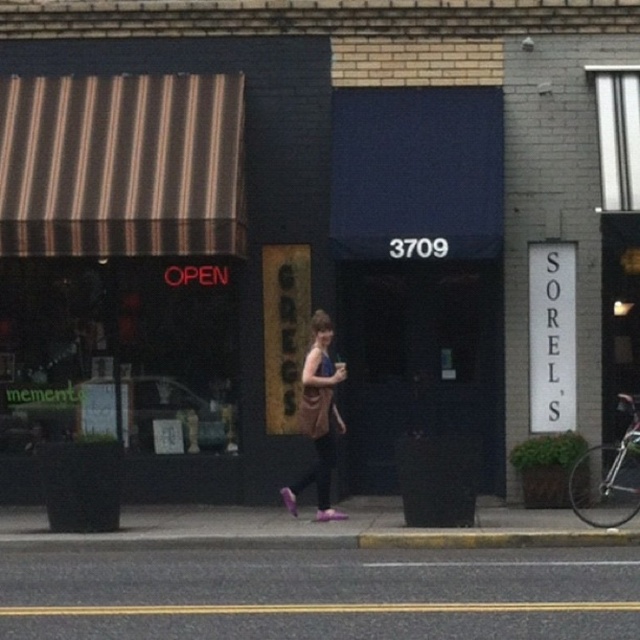
Question: Can you confirm if black asphalt road at lower center is positioned to the left of matte brown purse at center?

Choices:
 (A) no
 (B) yes

Answer: (B)

Question: Which object is positioned farthest from the black asphalt road at lower center?

Choices:
 (A) yellow concrete curb at lower center
 (B) matte brown purse at center

Answer: (B)

Question: Estimate the real-world distances between objects in this image. Which object is farther from the yellow concrete curb at lower center?

Choices:
 (A) matte brown purse at center
 (B) black asphalt road at lower center

Answer: (A)

Question: Which point is farther from the camera taking this photo?

Choices:
 (A) (314, 324)
 (B) (481, 545)

Answer: (A)

Question: Is black asphalt road at lower center smaller than yellow concrete curb at lower center?

Choices:
 (A) no
 (B) yes

Answer: (A)

Question: Can you confirm if matte brown purse at center is positioned to the left of yellow concrete curb at lower center?

Choices:
 (A) yes
 (B) no

Answer: (A)